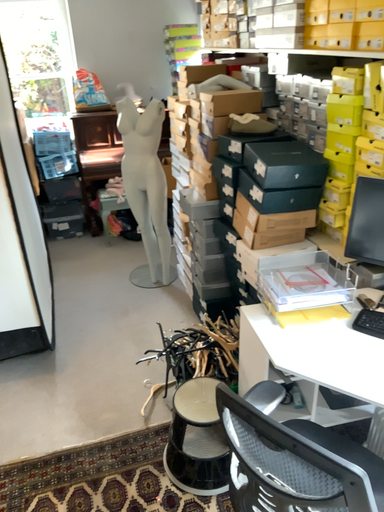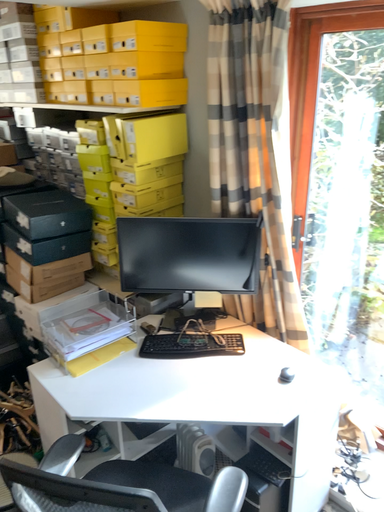
Question: How did the camera likely rotate when shooting the video?

Choices:
 (A) rotated upward
 (B) rotated downward

Answer: (A)